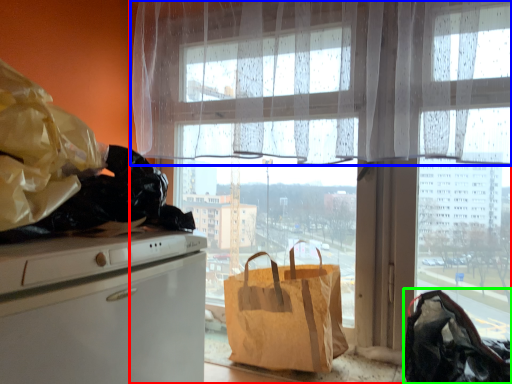
Question: Which object is positioned farthest from window (highlighted by a red box)? Select from curtain (highlighted by a blue box) and handbag (highlighted by a green box).

Choices:
 (A) curtain
 (B) handbag

Answer: (B)